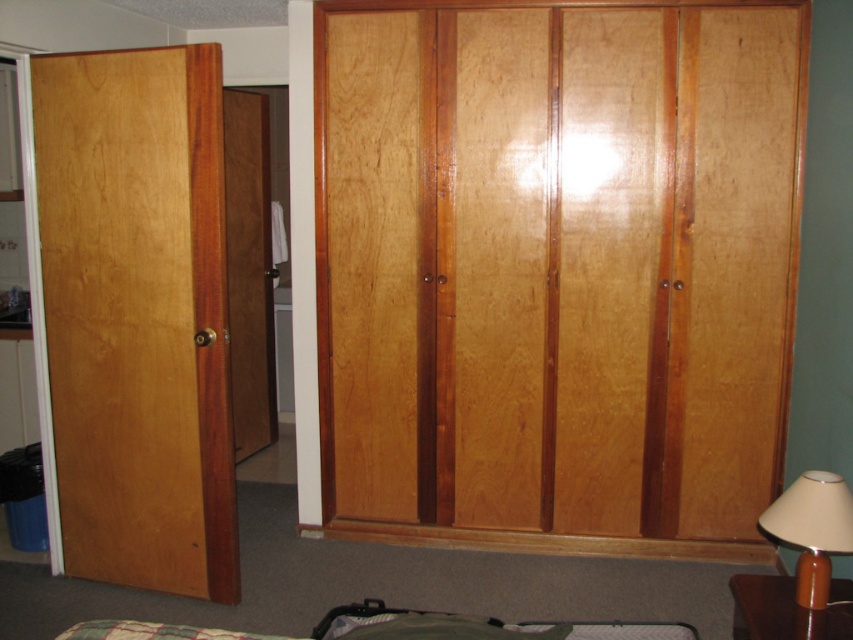
Who is more forward, (556, 243) or (766, 516)?

Point (766, 516)

Is glossy wood dresser at center positioned behind brown matte lamp at lower right?

Yes, it is.

Between point (618, 474) and point (804, 525), which one is positioned in front?

Point (804, 525) is more forward.

Locate an element on the screen. The image size is (853, 640). glossy wood dresser at center is located at coordinates (556, 268).

Between light brown wood door at left and wooden door at center, which one appears on the right side from the viewer's perspective?

wooden door at center is more to the right.

How far apart are light brown wood door at left and wooden door at center?

They are 4.98 feet apart.

Describe the element at coordinates (137, 316) in the screenshot. I see `light brown wood door at left` at that location.

I want to click on light brown wood door at left, so click(137, 316).

Is point (250, 308) closer to camera compared to point (593, 628)?

No, (250, 308) is further to viewer.

Locate an element on the screen. Image resolution: width=853 pixels, height=640 pixels. wooden door at center is located at coordinates (248, 269).